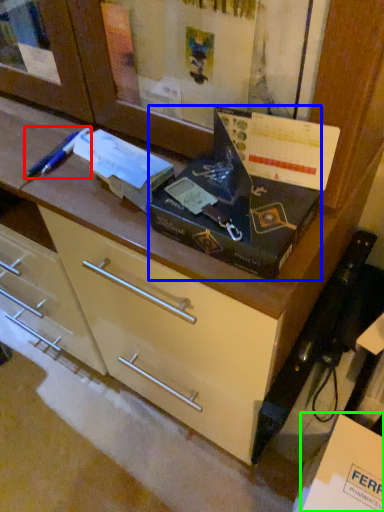
Question: Estimate the real-world distances between objects in this image. Which object is closer to penguin (highlighted by a red box), box (highlighted by a blue box) or cardboard box (highlighted by a green box)?

Choices:
 (A) box
 (B) cardboard box

Answer: (A)